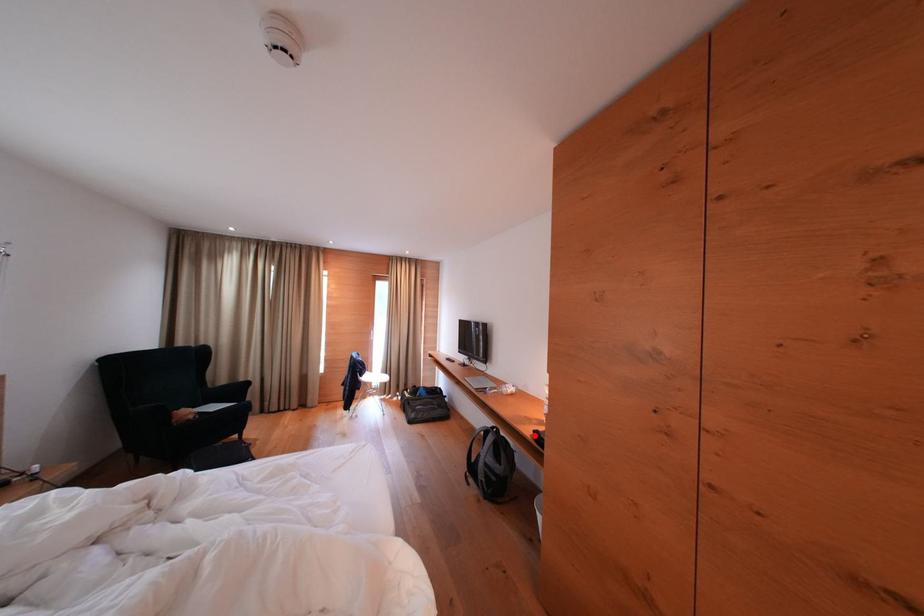
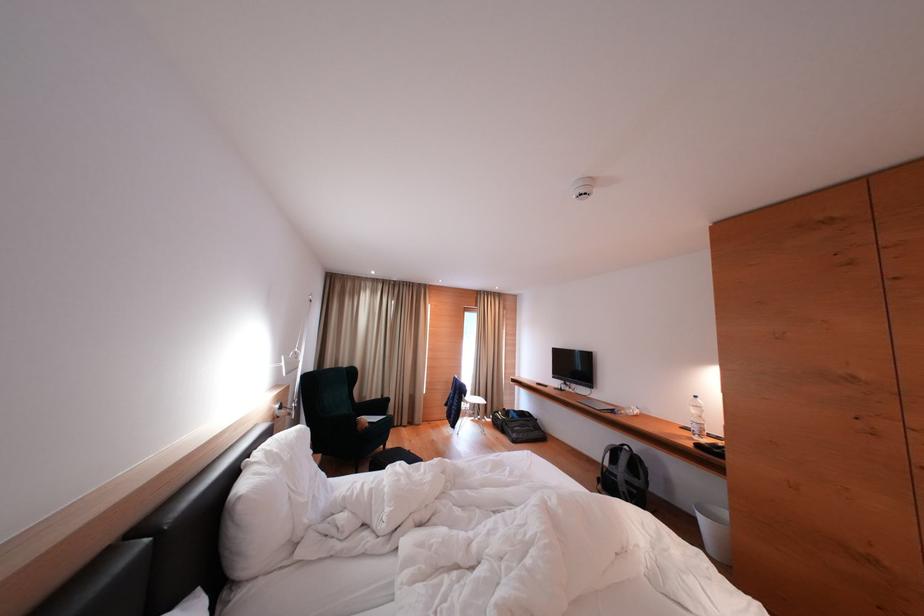
The point at the highlighted location is marked in the first image. Where is the corresponding point in the second image?

(696, 448)